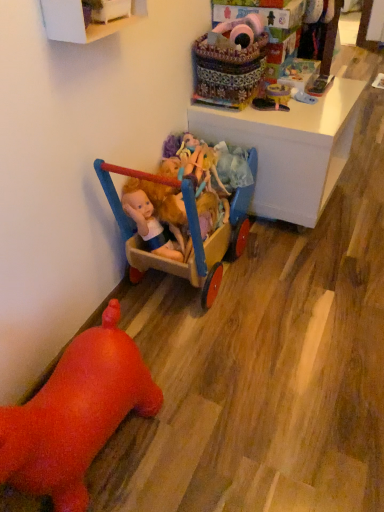
Locate an element on the screen. Image resolution: width=384 pixels, height=512 pixels. free location in front of black rubber shoe at upper right, acting as the third toy starting from the top is located at coordinates (288, 120).